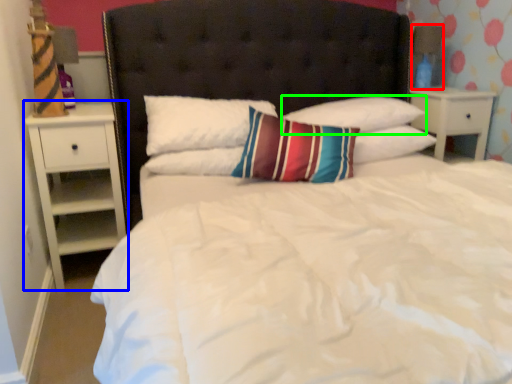
Question: Based on their relative distances, which object is nearer to lamp (highlighted by a red box)? Choose from nightstand (highlighted by a blue box) and pillow (highlighted by a green box).

Choices:
 (A) nightstand
 (B) pillow

Answer: (B)